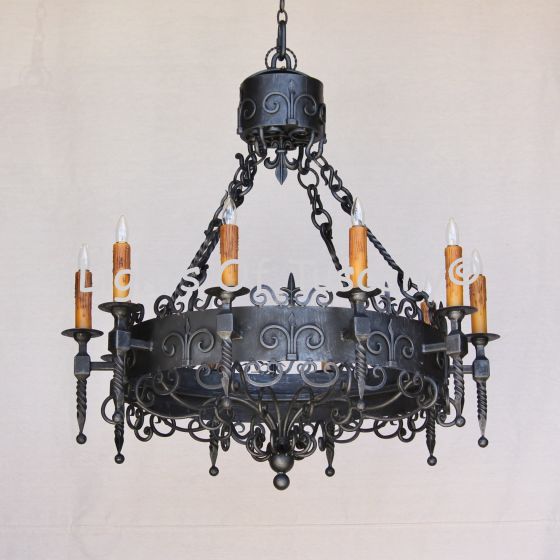
Where is `round top of light`? This screenshot has width=560, height=560. round top of light is located at coordinates (270, 82).